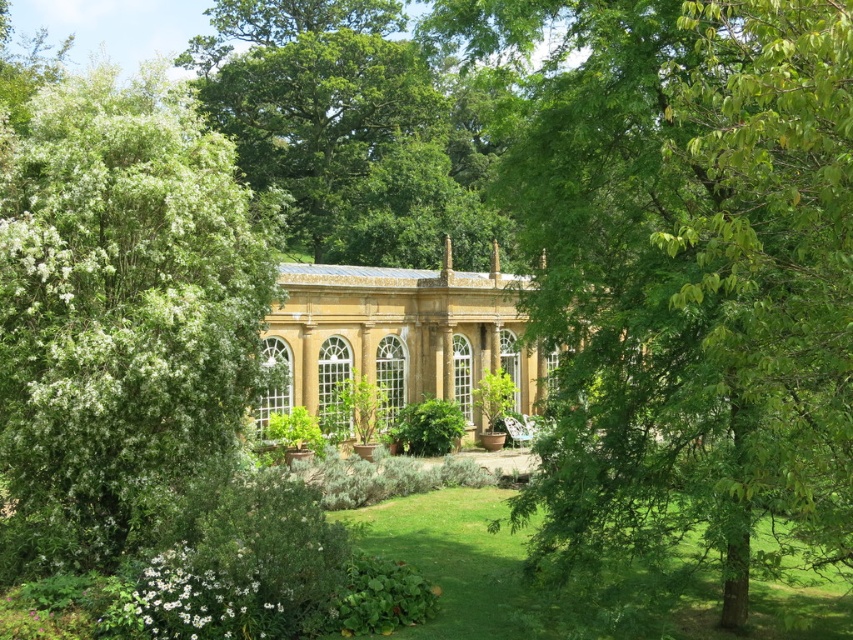
Does point (595, 268) lie behind point (386, 324)?

No.

You are a GUI agent. You are given a task and a screenshot of the screen. Output one action in this format:
    pyautogui.click(x=<x>, y=<y>)
    Task: Click on the green leafy tree at center
    The height and width of the screenshot is (640, 853).
    Given the screenshot: What is the action you would take?
    pyautogui.click(x=688, y=269)

Looking at this image, can you confirm if green leafy tree at center is positioned to the right of green leafy tree at left?

Correct, you'll find green leafy tree at center to the right of green leafy tree at left.

Locate an element on the screen. The image size is (853, 640). green leafy tree at center is located at coordinates (688, 269).

Is green leafy tree at left smaller than golden stone palace at center?

Actually, green leafy tree at left might be larger than golden stone palace at center.

Locate an element on the screen. The height and width of the screenshot is (640, 853). green leafy tree at left is located at coordinates (120, 314).

This screenshot has height=640, width=853. What are the coordinates of `green leafy tree at left` in the screenshot? It's located at (120, 314).